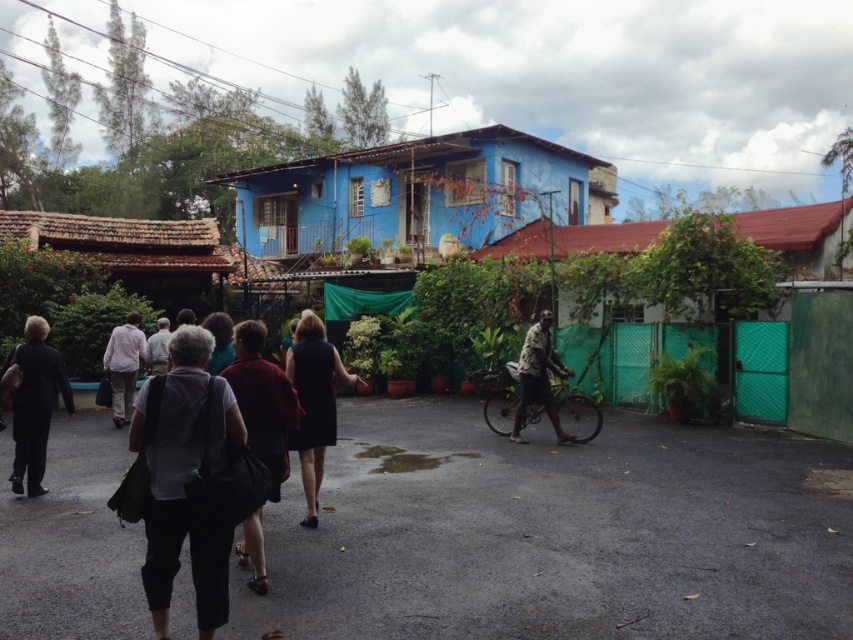
Does dark brown textured shirt at center appear over gray fabric jacket at center?

Incorrect, dark brown textured shirt at center is not positioned above gray fabric jacket at center.

Looking at this image, does dark brown textured shirt at center have a larger size compared to gray fabric jacket at center?

Yes, dark brown textured shirt at center is bigger than gray fabric jacket at center.

What do you see at coordinates (538, 376) in the screenshot? The height and width of the screenshot is (640, 853). I see `dark brown textured shirt at center` at bounding box center [538, 376].

Where is `dark brown textured shirt at center`? The width and height of the screenshot is (853, 640). dark brown textured shirt at center is located at coordinates (538, 376).

Consider the image. Which of these two, dark gray fabric dress at center or gray fabric jacket at center, stands taller?

Standing taller between the two is gray fabric jacket at center.

Is point (216, 321) in front of point (152, 337)?

Yes, point (216, 321) is closer to viewer.

Identify the location of dark gray fabric dress at center. This screenshot has height=640, width=853. (219, 340).

Is dark gray fabric bag at center further to the viewer compared to dark gray suit at left?

No, it is in front of dark gray suit at left.

Is dark gray fabric bag at center closer to camera compared to dark gray suit at left?

Yes, dark gray fabric bag at center is closer to the viewer.

The image size is (853, 640). Identify the location of dark gray fabric bag at center. (186, 483).